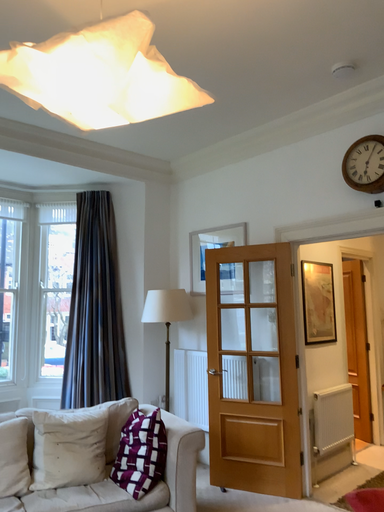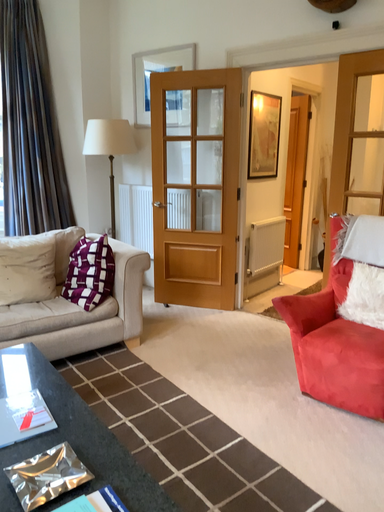
Question: How did the camera likely rotate when shooting the video?

Choices:
 (A) rotated right
 (B) rotated left

Answer: (A)